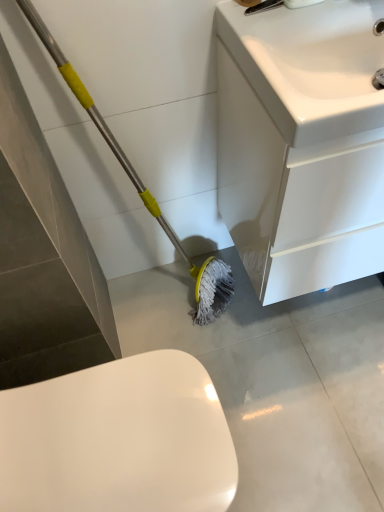
Question: Is white glossy cabinet at lower right looking in the opposite direction of white glossy sink at upper right?

Choices:
 (A) yes
 (B) no

Answer: (B)

Question: Is white glossy cabinet at lower right not inside white glossy sink at upper right?

Choices:
 (A) yes
 (B) no

Answer: (A)

Question: From the image's perspective, is white glossy cabinet at lower right located above white glossy sink at upper right?

Choices:
 (A) no
 (B) yes

Answer: (A)

Question: Is the position of white glossy cabinet at lower right less distant than that of white glossy sink at upper right?

Choices:
 (A) no
 (B) yes

Answer: (A)

Question: Considering the relative sizes of white glossy cabinet at lower right and white glossy sink at upper right in the image provided, is white glossy cabinet at lower right wider than white glossy sink at upper right?

Choices:
 (A) yes
 (B) no

Answer: (B)

Question: Can you confirm if white glossy cabinet at lower right is thinner than white glossy sink at upper right?

Choices:
 (A) no
 (B) yes

Answer: (B)

Question: Is white glossy sink at upper right facing towards white glossy cabinet at lower right?

Choices:
 (A) no
 (B) yes

Answer: (B)

Question: Is white glossy sink at upper right closer to camera compared to white glossy cabinet at lower right?

Choices:
 (A) yes
 (B) no

Answer: (A)

Question: Is white glossy sink at upper right smaller than white glossy cabinet at lower right?

Choices:
 (A) yes
 (B) no

Answer: (A)

Question: From a real-world perspective, is white glossy sink at upper right beneath white glossy cabinet at lower right?

Choices:
 (A) yes
 (B) no

Answer: (B)

Question: Is white glossy sink at upper right outside of white glossy cabinet at lower right?

Choices:
 (A) no
 (B) yes

Answer: (A)

Question: Is white glossy sink at upper right at the left side of white glossy cabinet at lower right?

Choices:
 (A) yes
 (B) no

Answer: (A)

Question: Is white glossy cabinet at lower right thinner than white glossy toilet at lower left?

Choices:
 (A) yes
 (B) no

Answer: (A)